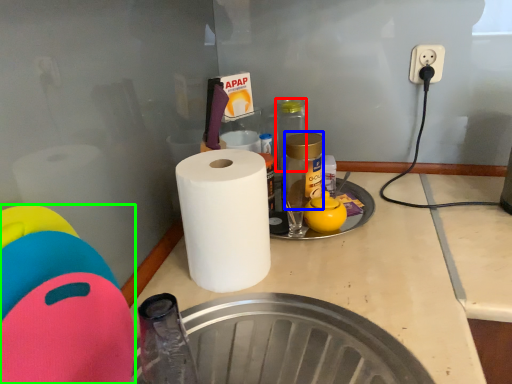
Question: Estimate the real-world distances between objects in this image. Which object is farther from bottle (highlighted by a red box), bottle (highlighted by a blue box) or toy (highlighted by a green box)?

Choices:
 (A) bottle
 (B) toy

Answer: (B)